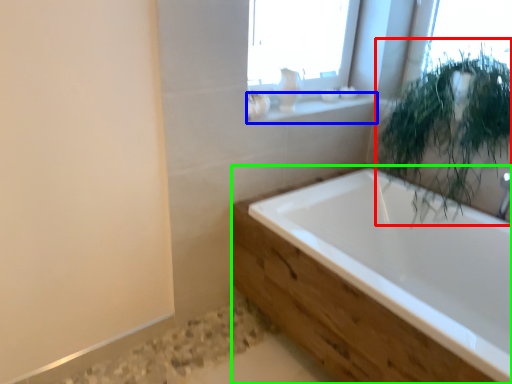
Question: Considering the real-world distances, which object is farthest from vegetation (highlighted by a red box)? window sill (highlighted by a blue box) or bathtub (highlighted by a green box)?

Choices:
 (A) window sill
 (B) bathtub

Answer: (A)